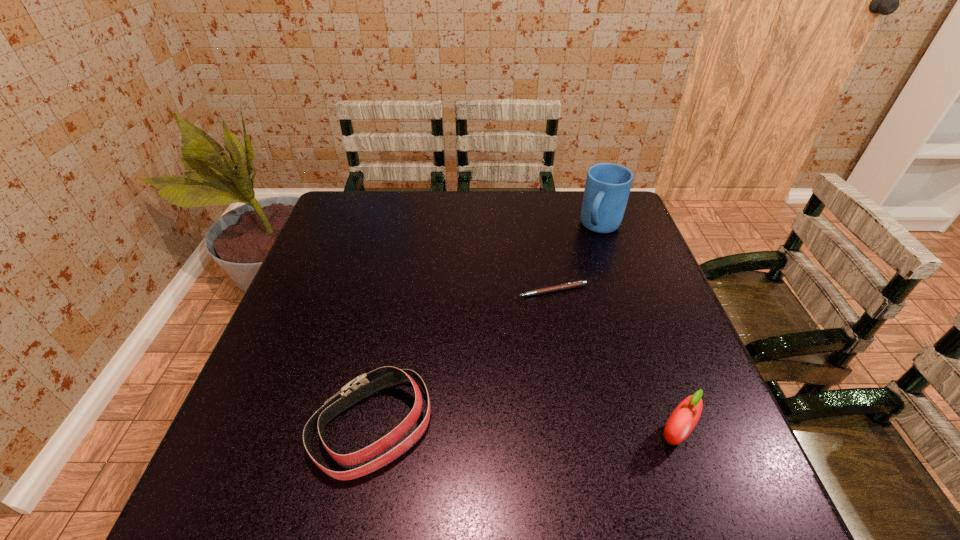
Find the location of a particular element. Image resolution: width=960 pixels, height=540 pixels. vacant area that lies between the third shortest object and the third nearest object is located at coordinates (614, 363).

In order to click on blank region between the tallest object and the dog collar in this screenshot , I will do `click(487, 327)`.

In order to click on object that is the third closest to the third shortest object in this screenshot , I will do `click(607, 188)`.

The image size is (960, 540). I want to click on object that stands as the second closest to the pen, so click(x=364, y=385).